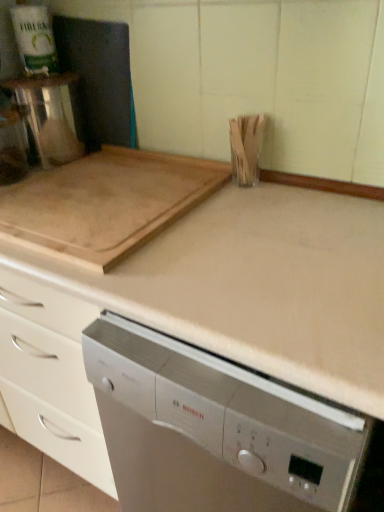
Question: Does satin silver dishwasher at center appear on the left side of natural wood cutting board at upper left?

Choices:
 (A) yes
 (B) no

Answer: (B)

Question: From the image's perspective, is satin silver dishwasher at center over natural wood cutting board at upper left?

Choices:
 (A) yes
 (B) no

Answer: (B)

Question: Are satin silver dishwasher at center and natural wood cutting board at upper left beside each other?

Choices:
 (A) yes
 (B) no

Answer: (B)

Question: Does satin silver dishwasher at center have a greater width compared to natural wood cutting board at upper left?

Choices:
 (A) no
 (B) yes

Answer: (B)

Question: Does satin silver dishwasher at center have a greater height compared to natural wood cutting board at upper left?

Choices:
 (A) no
 (B) yes

Answer: (B)

Question: Is satin silver dishwasher at center facing towards natural wood cutting board at upper left?

Choices:
 (A) yes
 (B) no

Answer: (B)

Question: Is natural wood cutting board at upper left aimed at satin silver dishwasher at center?

Choices:
 (A) no
 (B) yes

Answer: (A)

Question: Considering the relative positions of natural wood cutting board at upper left and satin silver dishwasher at center in the image provided, is natural wood cutting board at upper left to the left of satin silver dishwasher at center from the viewer's perspective?

Choices:
 (A) no
 (B) yes

Answer: (B)

Question: Is natural wood cutting board at upper left completely or partially outside of satin silver dishwasher at center?

Choices:
 (A) yes
 (B) no

Answer: (A)

Question: Is natural wood cutting board at upper left smaller than satin silver dishwasher at center?

Choices:
 (A) yes
 (B) no

Answer: (A)

Question: Is natural wood cutting board at upper left bigger than satin silver dishwasher at center?

Choices:
 (A) no
 (B) yes

Answer: (A)

Question: Is natural wood cutting board at upper left shorter than satin silver dishwasher at center?

Choices:
 (A) yes
 (B) no

Answer: (A)

Question: Is satin silver dishwasher at center bigger or smaller than natural wood cutting board at upper left?

Choices:
 (A) big
 (B) small

Answer: (A)